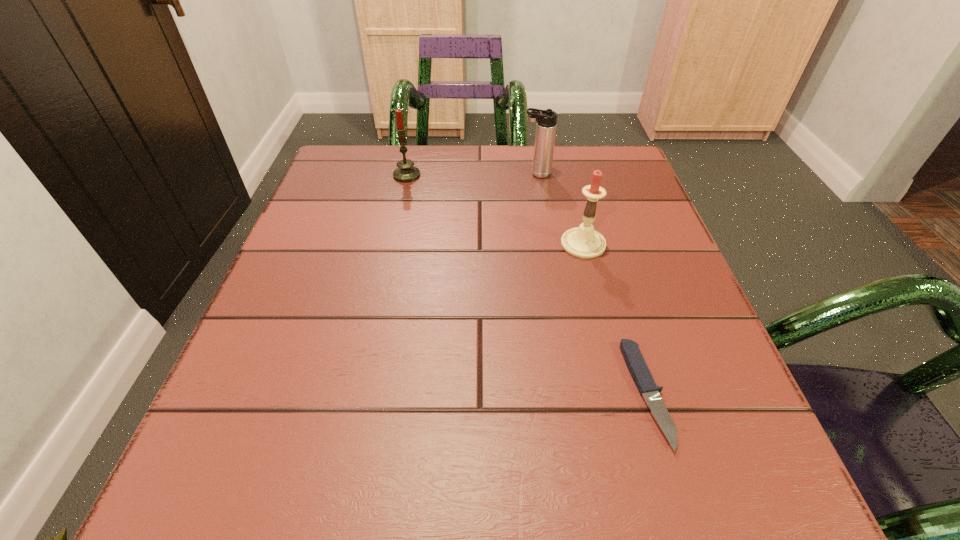
This screenshot has height=540, width=960. I want to click on free spot between the leftmost object and the thermos bottle, so click(x=471, y=174).

At what (x,y) coordinates should I click in order to perform the action: click on vacant area that lies between the second nearest object and the thermos bottle. Please return your answer as a coordinate pair (x, y). This screenshot has width=960, height=540. Looking at the image, I should click on (560, 209).

Find the location of a particular element. The width and height of the screenshot is (960, 540). unoccupied area between the shortest object and the nearer candle is located at coordinates (615, 319).

Locate an element on the screen. The width and height of the screenshot is (960, 540). empty space that is in between the steak knife and the farther candle is located at coordinates (527, 285).

What are the coordinates of `free area in between the thermos bottle and the leftmost object` in the screenshot? It's located at (471, 174).

You are a GUI agent. You are given a task and a screenshot of the screen. Output one action in this format:
    pyautogui.click(x=<x>, y=<y>)
    Task: Click on the unoccupied position between the nearest object and the thermos bottle
    The height and width of the screenshot is (540, 960).
    Given the screenshot: What is the action you would take?
    pyautogui.click(x=591, y=284)

Locate an element on the screen. The image size is (960, 540). object that is the third nearest to the nearer candle is located at coordinates (406, 172).

Select which object is the third closest to the nearest object. Please provide its 2D coordinates. Your answer should be formatted as a tuple, i.e. [(x, y)], where the tuple contains the x and y coordinates of a point satisfying the conditions above.

[(406, 172)]

Find the location of a particular element. free space that satisfies the following two spatial constraints: 1. on the back side of the nearest object; 2. on the handle side of the thermos bottle is located at coordinates (581, 174).

Find the location of a particular element. The image size is (960, 540). vacant space that satisfies the following two spatial constraints: 1. on the handle side of the thermos bottle; 2. on the back side of the third farthest object is located at coordinates (548, 244).